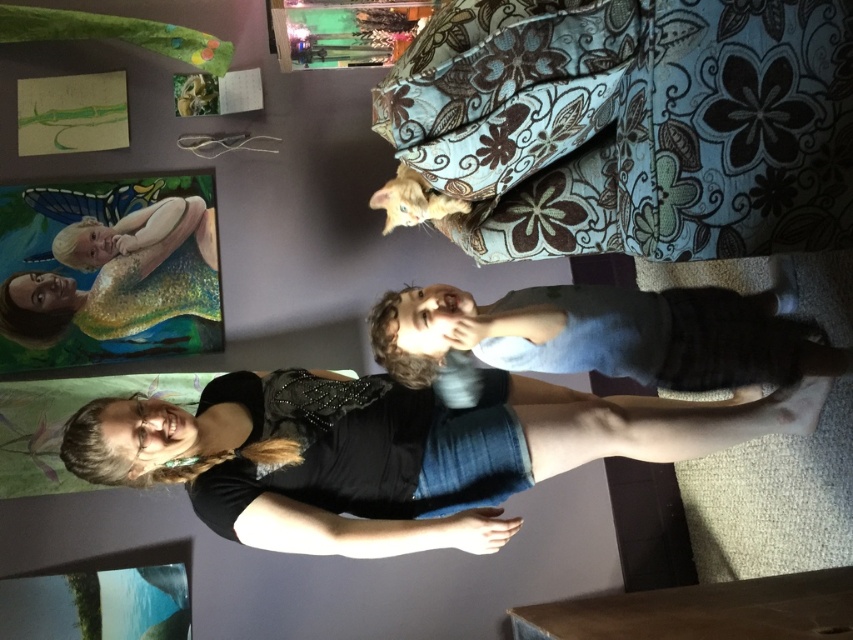
Between point (653, 384) and point (207, 304), which one is positioned behind?

The point (207, 304) is more distant.

Which of these two, light blue fabric at center or matte black shirt at lower left, stands taller?

matte black shirt at lower left is taller.

Is point (728, 381) positioned after point (183, 230)?

That is False.

Locate an element on the screen. light blue fabric at center is located at coordinates (604, 336).

Can you confirm if black denim shorts at lower center is positioned below matte black shirt at lower left?

Indeed, black denim shorts at lower center is positioned under matte black shirt at lower left.

Is point (564, 445) closer to camera compared to point (109, 305)?

Yes, it is.

The image size is (853, 640). Find the location of `black denim shorts at lower center`. black denim shorts at lower center is located at coordinates [x=302, y=476].

Is black denim shorts at lower center positioned before light blue fabric at center?

Yes, it is.

Who is more distant from viewer, (277,502) or (554,298)?

Positioned behind is point (554,298).

Where is `black denim shorts at lower center`? This screenshot has height=640, width=853. black denim shorts at lower center is located at coordinates coord(302,476).